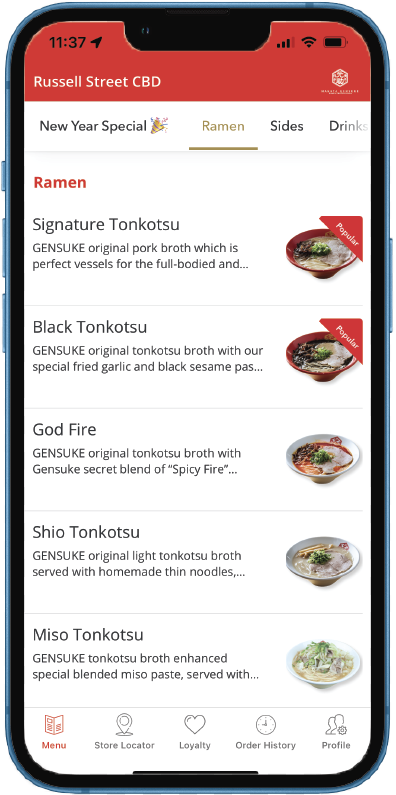
The height and width of the screenshot is (795, 396). Find the location of `white bowl`. white bowl is located at coordinates (356, 671).